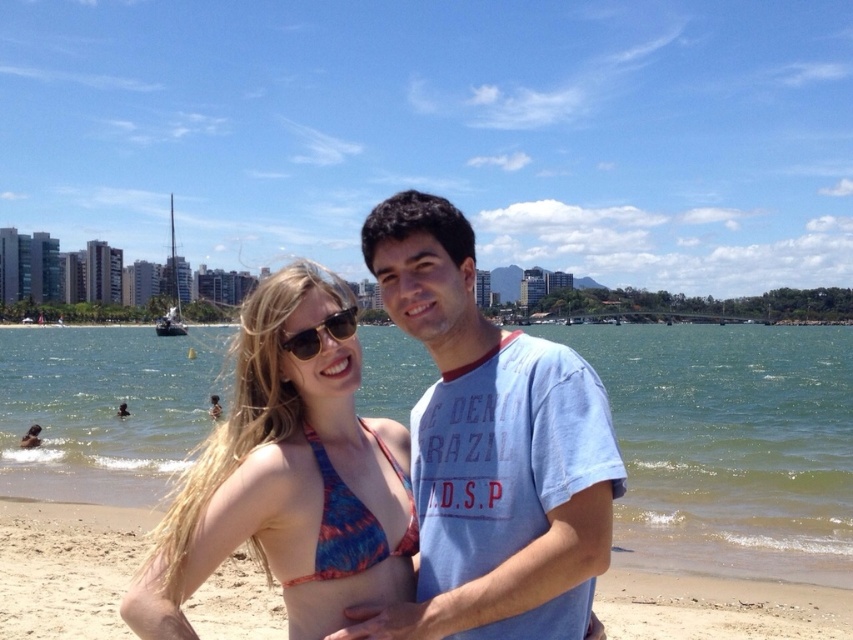
Can you confirm if beige sand at center is taller than blue printed bikini top at center?

In fact, beige sand at center may be shorter than blue printed bikini top at center.

Which is behind, point (688, 592) or point (297, 600)?

The point (688, 592) is behind.

The image size is (853, 640). I want to click on beige sand at center, so click(67, 566).

Who is taller, blue water at center or light blue cotton t-shirt at center?

blue water at center is taller.

Which is more to the left, blue water at center or light blue cotton t-shirt at center?

Positioned to the left is light blue cotton t-shirt at center.

Between point (6, 364) and point (544, 493), which one is positioned behind?

Positioned behind is point (6, 364).

Where is `blue water at center`? Image resolution: width=853 pixels, height=640 pixels. blue water at center is located at coordinates (729, 445).

Is beige sand at center thinner than sunglasses at center?

In fact, beige sand at center might be wider than sunglasses at center.

Is point (721, 634) more distant than point (346, 332)?

Yes, it is behind point (346, 332).

Identify the location of beige sand at center. (67, 566).